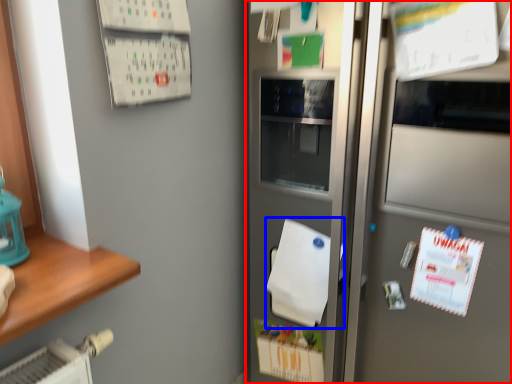
Question: Among these objects, which one is nearest to the camera, refrigerator (highlighted by a red box) or wrapping paper (highlighted by a blue box)?

Choices:
 (A) refrigerator
 (B) wrapping paper

Answer: (A)